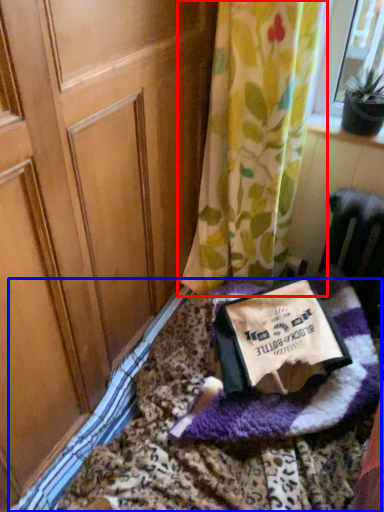
Question: Which point is further to the camera, curtain (highlighted by a red box) or bedding (highlighted by a blue box)?

Choices:
 (A) curtain
 (B) bedding

Answer: (A)